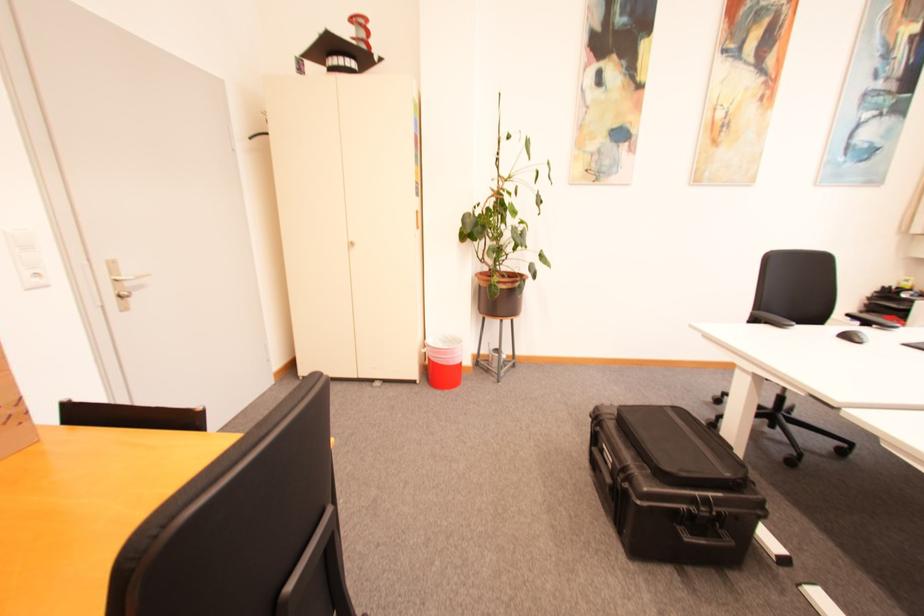
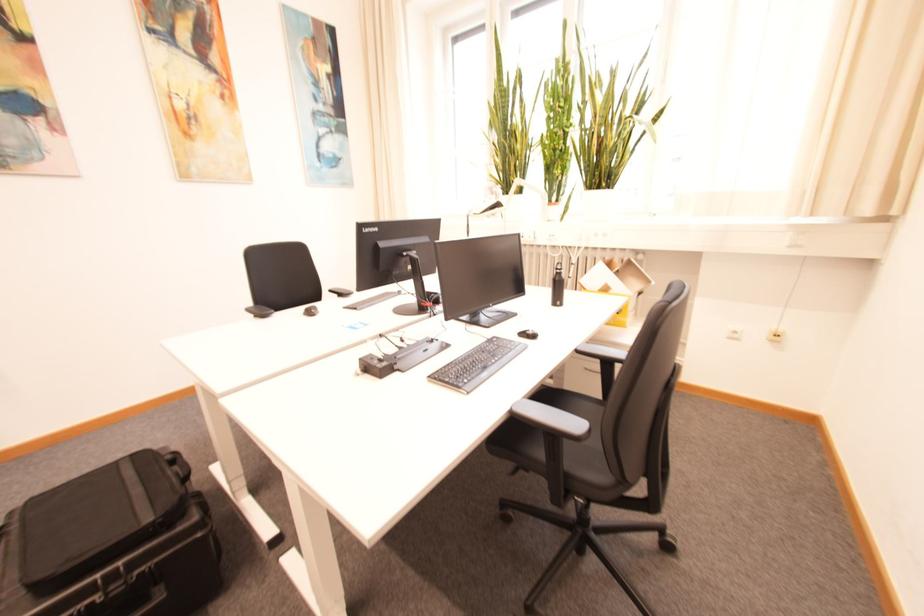
Question: The camera is either moving clockwise (left) or counter-clockwise (right) around the object. The first image is from the beginning of the video and the second image is from the end. Is the camera moving left or right when shooting the video?

Choices:
 (A) Left
 (B) Right

Answer: (A)